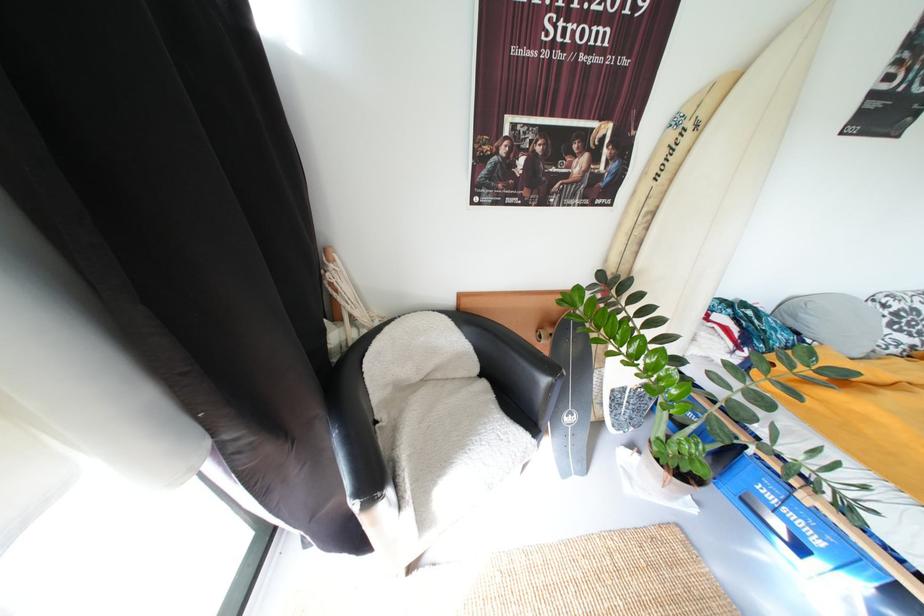
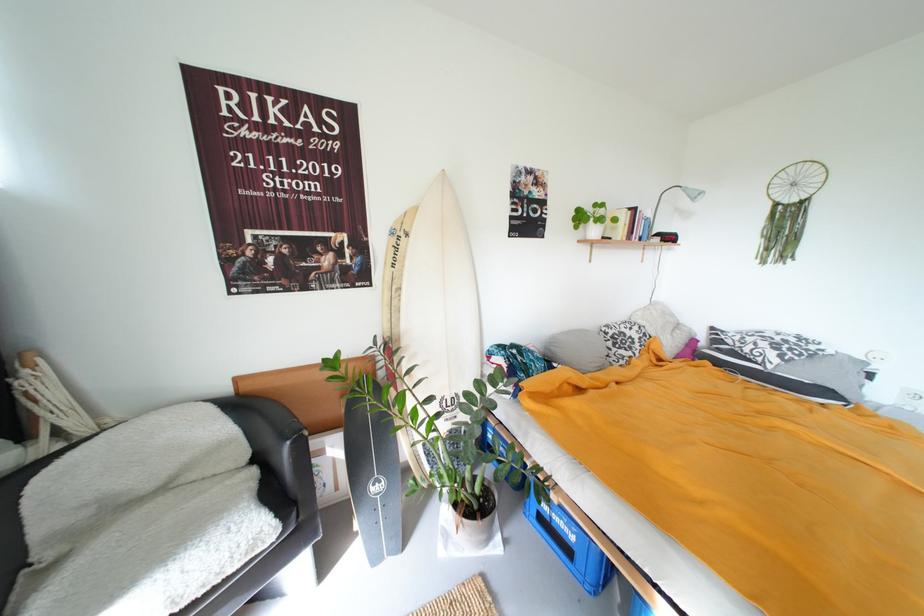
The point at (642, 235) is marked in the first image. Where is the corresponding point in the second image?

(402, 306)